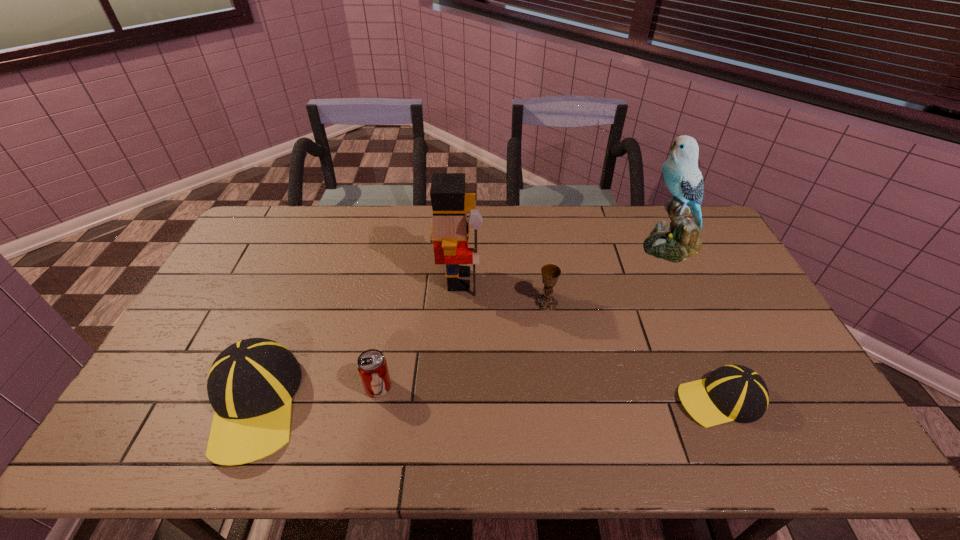
In order to click on blank space located 0.340m with the brim of the shorter baseball cap facing forward in this screenshot , I will do click(x=543, y=399).

Find the location of a particular element. This screenshot has width=960, height=540. vacant region located 0.110m with the brim of the shorter baseball cap facing forward is located at coordinates (634, 399).

Identify the location of free space located 0.370m on the face of the parakeet. (533, 245).

Identify the location of free space located on the face of the parakeet. This screenshot has height=540, width=960. (562, 245).

What are the coordinates of `free region located 0.280m on the face of the parakeet` in the screenshot? It's located at (559, 245).

You are a GUI agent. You are given a task and a screenshot of the screen. Output one action in this format:
    pyautogui.click(x=<x>, y=<y>)
    Task: Click on the free spot located 0.370m on the left of the chalice
    This screenshot has width=960, height=540.
    Given the screenshot: What is the action you would take?
    tap(415, 303)

The image size is (960, 540). In order to click on vacant space located 0.350m in front of the nutcracker holding the staff in this screenshot , I will do `click(589, 280)`.

Find the location of a particular element. Image resolution: width=960 pixels, height=540 pixels. free spot located on the right of the second shortest object is located at coordinates (538, 387).

Find the location of a particular element. Image resolution: width=960 pixels, height=540 pixels. object that is positioned at the far edge is located at coordinates (680, 240).

Where is `pop soda present at the near edge`? The image size is (960, 540). pop soda present at the near edge is located at coordinates (372, 366).